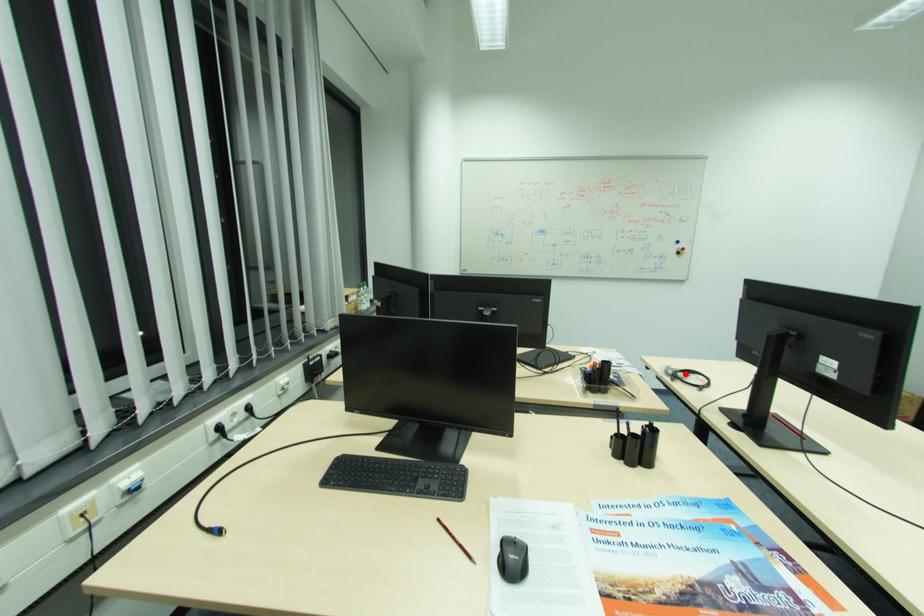
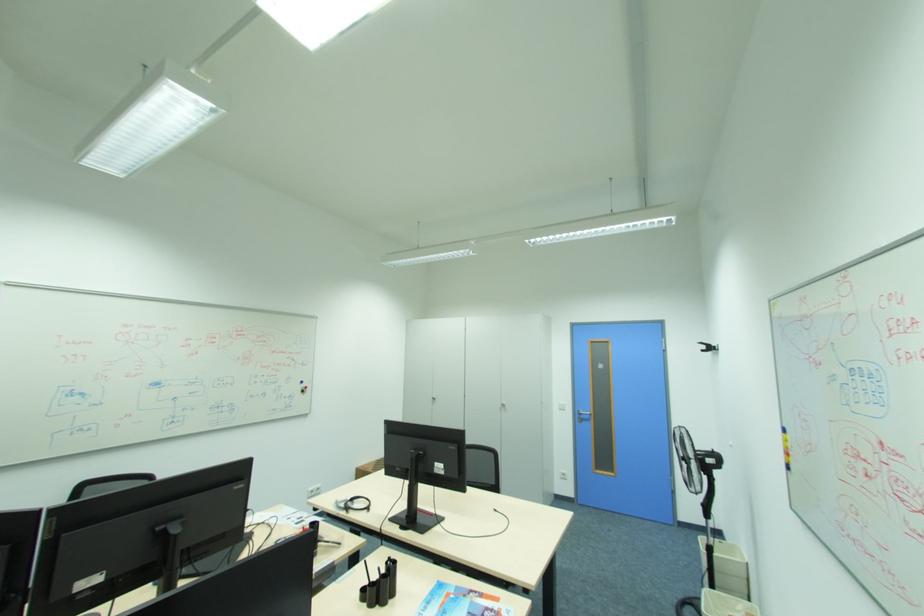
Question: I am providing you with two images of the same scene from different viewpoints. A red point is marked on the first image. At the location where the point appears in image 1, is it still visible in image 2?

Choices:
 (A) Yes
 (B) No

Answer: (A)